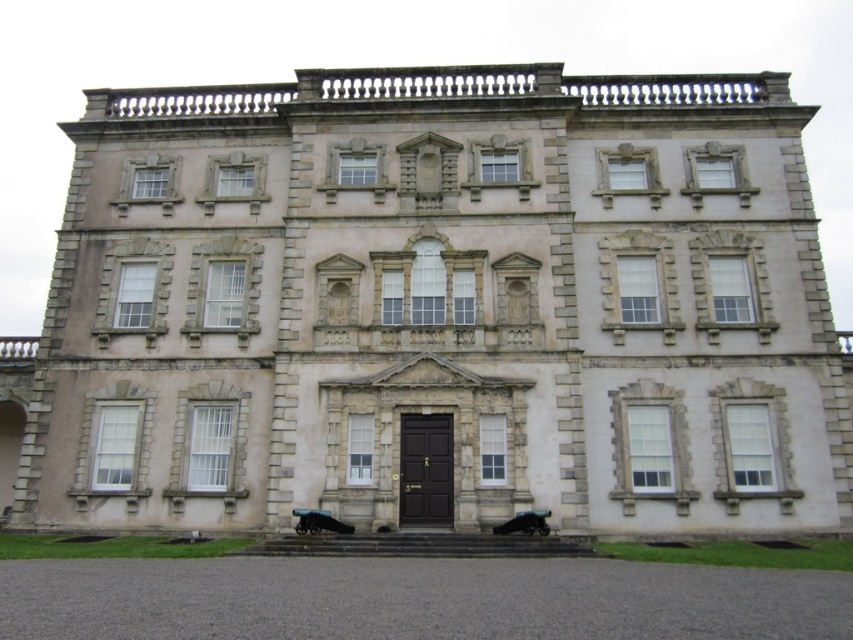
You are standing in front of the grand classical building and see a shiny black dog at center and a shiny black car at lower center. Which object is wider?

The shiny black car at lower center is wider than the shiny black dog at center.

You are standing at point A located at point (x=322, y=516). You want to walk to point B, which is 44.68 meters away from you. Is there enough space between the mansion and the nearby trees to walk directly to point B?

The distance between point A and point B is 44.68 meters. However, the scene description does not mention any nearby trees obstructing the path, so there should be enough space to walk directly to point B.

You are standing in front of the grand classical building and see a shiny black dog at center and a shiny black car at lower center. Which object is positioned to the left of the other?

The shiny black dog at center is to the left of the shiny black car at lower center.